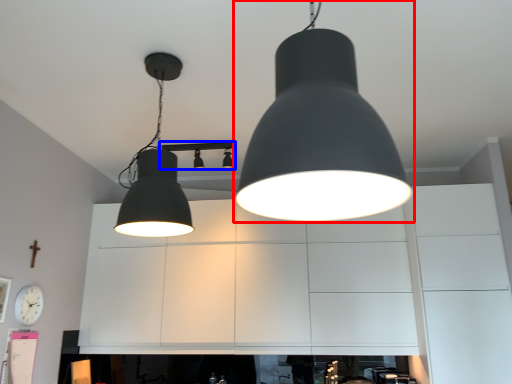
Question: Which object is closer to the camera taking this photo, lamp (highlighted by a red box) or lamp (highlighted by a blue box)?

Choices:
 (A) lamp
 (B) lamp

Answer: (A)